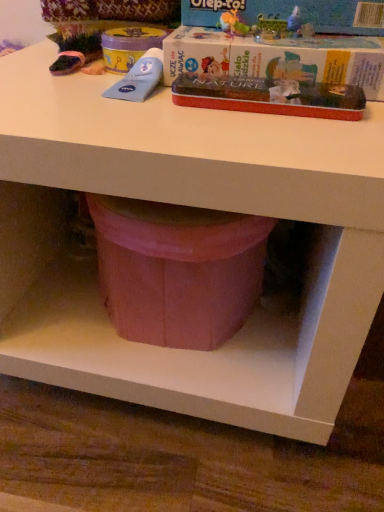
Question: Is metallic red tin at upper center, the third paperback book positioned from the top, inside the boundaries of red cardboard box at upper center, which is the 2th paperback book from top to bottom, or outside?

Choices:
 (A) inside
 (B) outside

Answer: (B)

Question: Considering the relative positions of metallic red tin at upper center, the 1th paperback book positioned from the bottom, and red cardboard box at upper center, which is the 2th paperback book from top to bottom, in the image provided, is metallic red tin at upper center, the 1th paperback book positioned from the bottom, to the left or to the right of red cardboard box at upper center, which is the 2th paperback book from top to bottom,?

Choices:
 (A) right
 (B) left

Answer: (B)

Question: Which object is the closest to the matte cardboard box at upper center, which appears as the first paperback book when viewed from the top?

Choices:
 (A) red cardboard box at upper center, which is the 2th paperback book from top to bottom
 (B) metallic red tin at upper center, the third paperback book positioned from the top

Answer: (A)

Question: Which object is positioned farthest from the metallic red tin at upper center, the third paperback book positioned from the top?

Choices:
 (A) matte cardboard box at upper center, the third paperback book from the bottom
 (B) red cardboard box at upper center, which is the 2th paperback book from top to bottom

Answer: (A)